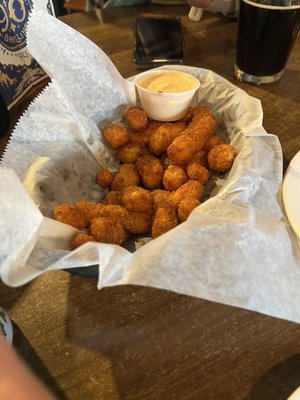
Locate an element on the screen. basket is located at coordinates click(72, 154).